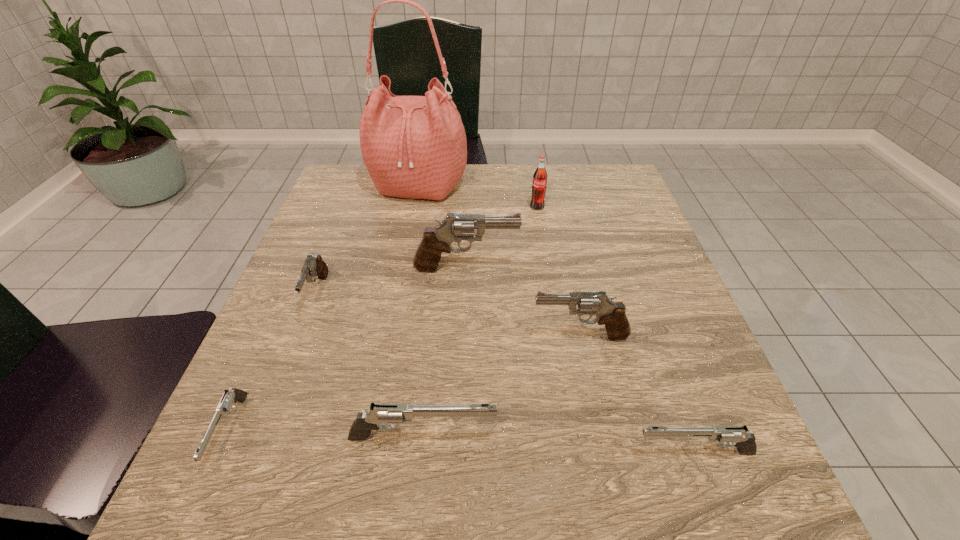
Locate an element on the screen. the rightmost silver pistol is located at coordinates (738, 436).

Locate an element on the screen. The height and width of the screenshot is (540, 960). the leftmost silver pistol is located at coordinates click(x=229, y=398).

Where is `the shortest object`? The image size is (960, 540). the shortest object is located at coordinates click(x=229, y=398).

The height and width of the screenshot is (540, 960). I want to click on blank area located 0.160m on the right of the tallest object, so click(526, 186).

Where is `free space located at the barrel of the tallest pistol`? The width and height of the screenshot is (960, 540). free space located at the barrel of the tallest pistol is located at coordinates (634, 268).

The width and height of the screenshot is (960, 540). In order to click on free space located on the label of the soda bottle in this screenshot , I will do `click(546, 260)`.

Identify the location of free space located at the barrel of the fourth nearest pistol. The height and width of the screenshot is (540, 960). (396, 336).

I want to click on free space located 0.190m at the barrel of the fourth nearest pistol, so click(429, 336).

This screenshot has height=540, width=960. Find the location of `free space located at the barrel of the fourth nearest pistol`. free space located at the barrel of the fourth nearest pistol is located at coordinates (456, 336).

Identify the location of free point located 0.180m on the front-facing side of the second silver pistol from right to left. This screenshot has height=540, width=960. (613, 437).